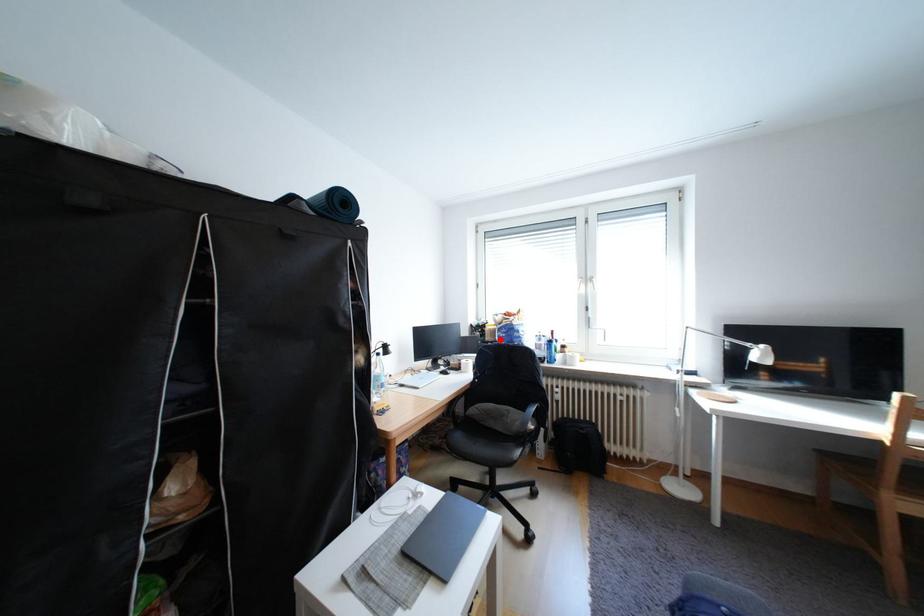
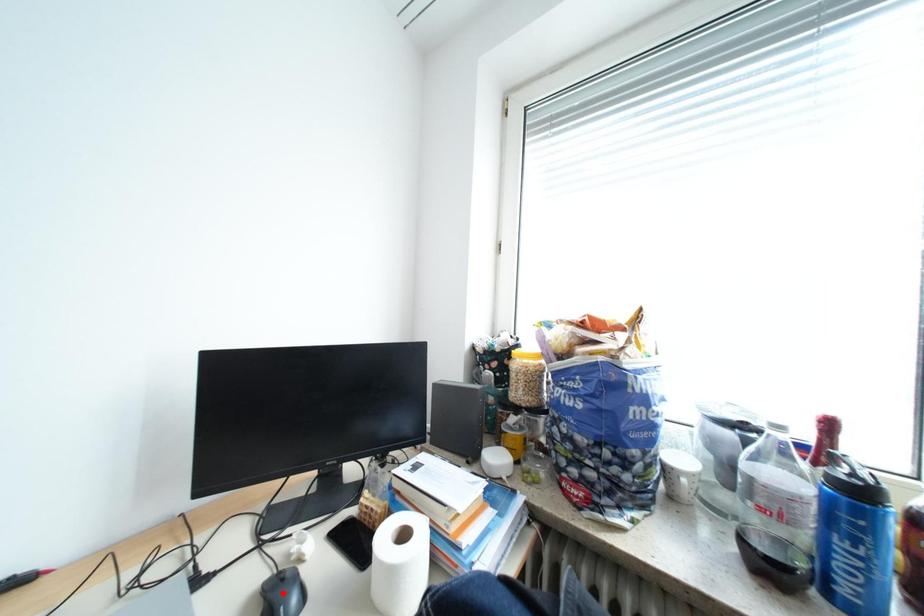
I am providing you with two images of the same scene from different viewpoints. A red point is marked on the first image and another point is marked on the second image. Does the point marked in image1 correspond to the same location as the one in image2?

No